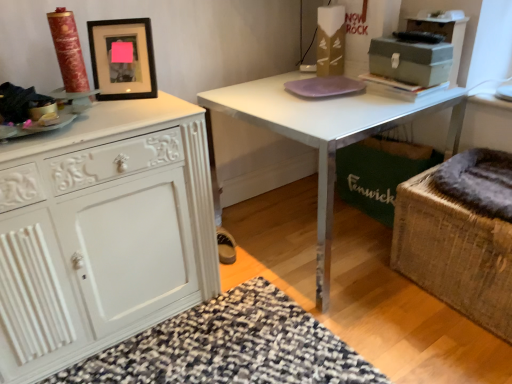
Question: Is dark gray plush at right, the 2th swivel chair from the bottom, not close to purple glass plate at center?

Choices:
 (A) yes
 (B) no

Answer: (B)

Question: Would you say purple glass plate at center is part of dark gray plush at right, which ranks as the 1th swivel chair in top-to-bottom order,'s contents?

Choices:
 (A) no
 (B) yes

Answer: (A)

Question: Is dark gray plush at right, which ranks as the 1th swivel chair in top-to-bottom order, looking in the opposite direction of purple glass plate at center?

Choices:
 (A) no
 (B) yes

Answer: (A)

Question: From a real-world perspective, is dark gray plush at right, which ranks as the 1th swivel chair in top-to-bottom order, on top of purple glass plate at center?

Choices:
 (A) yes
 (B) no

Answer: (B)

Question: Can you confirm if dark gray plush at right, the 2th swivel chair from the bottom, is wider than purple glass plate at center?

Choices:
 (A) no
 (B) yes

Answer: (B)

Question: Do you think white painted wood cabinet at left is within metallic gray cabinet at upper right, or outside of it?

Choices:
 (A) inside
 (B) outside

Answer: (B)

Question: From a real-world perspective, is white painted wood cabinet at left positioned above or below metallic gray cabinet at upper right?

Choices:
 (A) below
 (B) above

Answer: (A)

Question: Visually, is white painted wood cabinet at left positioned to the left or to the right of metallic gray cabinet at upper right?

Choices:
 (A) right
 (B) left

Answer: (B)

Question: Looking at their shapes, would you say white painted wood cabinet at left is wider or thinner than metallic gray cabinet at upper right?

Choices:
 (A) thin
 (B) wide

Answer: (B)

Question: Is white glossy table at center in front of or behind dark gray plush at right, which ranks as the 1th swivel chair in top-to-bottom order, in the image?

Choices:
 (A) front
 (B) behind

Answer: (A)

Question: Considering the positions of white glossy table at center and dark gray plush at right, the 2th swivel chair from the bottom, in the image, is white glossy table at center wider or thinner than dark gray plush at right, the 2th swivel chair from the bottom,?

Choices:
 (A) thin
 (B) wide

Answer: (B)

Question: Is white glossy table at center bigger or smaller than dark gray plush at right, the 2th swivel chair from the bottom?

Choices:
 (A) small
 (B) big

Answer: (B)

Question: From a real-world perspective, relative to dark gray plush at right, the 2th swivel chair from the bottom, is white glossy table at center vertically above or below?

Choices:
 (A) above
 (B) below

Answer: (B)

Question: In the image, is white painted wood cabinet at left positioned in front of or behind black matte picture frame at upper left?

Choices:
 (A) behind
 (B) front

Answer: (B)

Question: Choose the correct answer: Is white painted wood cabinet at left inside black matte picture frame at upper left or outside it?

Choices:
 (A) outside
 (B) inside

Answer: (A)